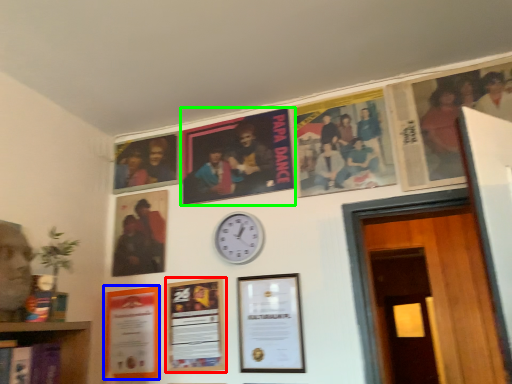
Question: Which object is positioned farthest from picture frame (highlighted by a red box)? Select from picture frame (highlighted by a blue box) and poster (highlighted by a green box).

Choices:
 (A) picture frame
 (B) poster

Answer: (B)